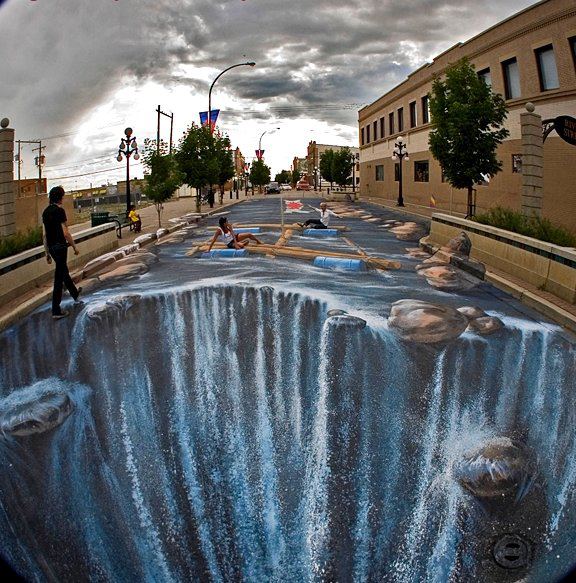
In order to click on square window in this screenshot , I will do `click(420, 167)`.